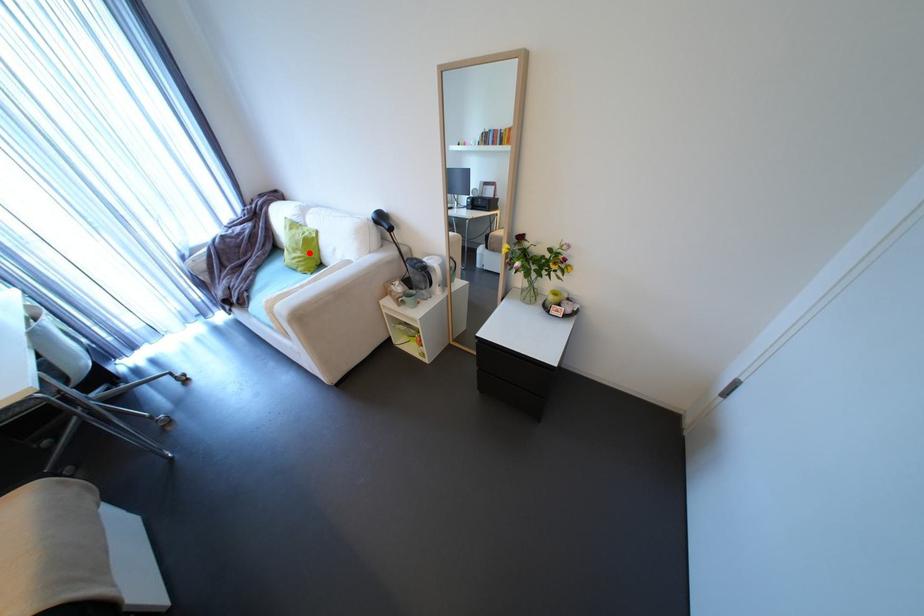
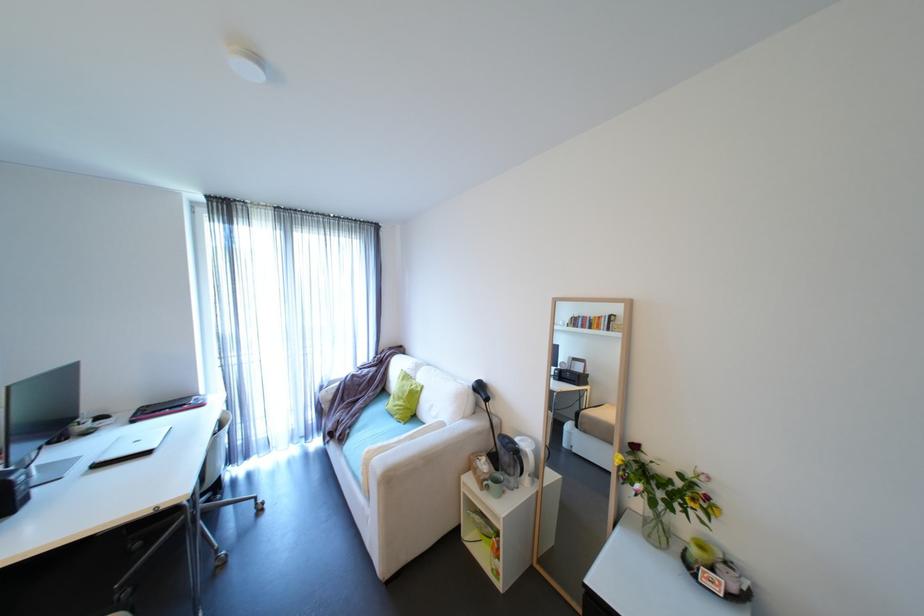
Question: A red point is marked in image1. In image2, is the corresponding 3D point closer to the camera or farther? Reply with the corresponding letter.

Choices:
 (A) The corresponding 3D point is closer.
 (B) The corresponding 3D point is farther.

Answer: (B)